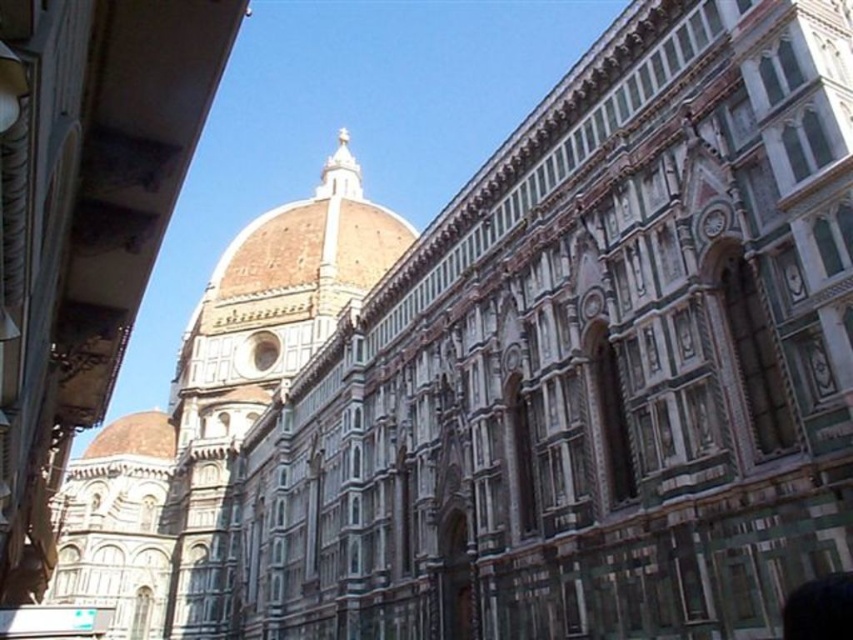
Is white marble tower at center to the left of matte brown dome at center from the viewer's perspective?

In fact, white marble tower at center is to the right of matte brown dome at center.

The image size is (853, 640). In order to click on white marble tower at center in this screenshot , I will do click(119, 525).

The width and height of the screenshot is (853, 640). What do you see at coordinates (258, 374) in the screenshot?
I see `brown marble dome at center` at bounding box center [258, 374].

Is brown marble dome at center above matte brown dome at center?

Yes.

This screenshot has width=853, height=640. Identify the location of brown marble dome at center. (258, 374).

Can you confirm if brown marble dome at center is smaller than white marble tower at center?

No.

Between point (229, 467) and point (146, 621), which one is positioned in front?

Point (146, 621)

Where is `brown marble dome at center`? brown marble dome at center is located at coordinates coord(258,374).